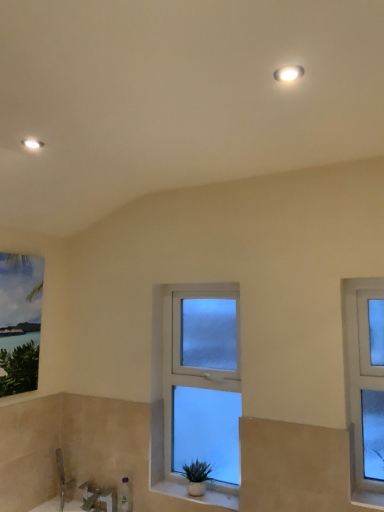
Question: Does point [x=210, y=470] appear closer or farther from the camera than point [x=225, y=435]?

Choices:
 (A) farther
 (B) closer

Answer: (B)

Question: From a real-world perspective, relative to clear glass window at center, which is the 1th window in left-to-right order, is green matte plant at center vertically above or below?

Choices:
 (A) above
 (B) below

Answer: (B)

Question: Estimate the real-world distances between objects in this image. Which object is closer to the matte white recessed light at upper left, which is counted as the 1th light fixture, starting from the bottom?

Choices:
 (A) clear glass window at right, acting as the first window starting from the right
 (B) green matte plant at center
 (C) clear glass window at center, acting as the first window starting from the back
 (D) white glossy light fixture at upper center, positioned as the 1th light fixture in top-to-bottom order
 (E) white ceramic window sill at center

Answer: (D)

Question: Which is nearer to the green matte plant at center?

Choices:
 (A) clear glass window at right, the 1th window in the front-to-back sequence
 (B) white glossy light fixture at upper center, positioned as the 1th light fixture in top-to-bottom order
 (C) matte white recessed light at upper left, positioned as the second light fixture in right-to-left order
 (D) white ceramic window sill at center
 (E) clear glass window at center, which is the 1th window in left-to-right order

Answer: (D)